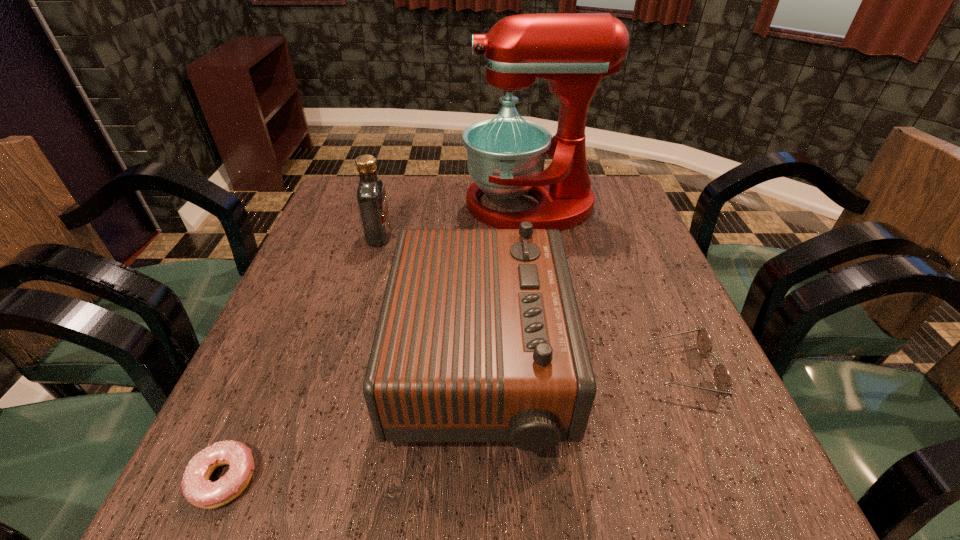
Locate an element on the screen. the tallest object is located at coordinates (572, 51).

At what (x,y) coordinates should I click in order to perform the action: click on vodka. Please return your answer as a coordinate pair (x, y). Looking at the image, I should click on (371, 194).

Find the location of a particular element. Image resolution: width=960 pixels, height=540 pixels. radio receiver is located at coordinates (479, 338).

Where is `spectacles`? This screenshot has width=960, height=540. spectacles is located at coordinates (722, 380).

Identify the location of doughnut. The height and width of the screenshot is (540, 960). (197, 488).

You are a GUI agent. You are given a task and a screenshot of the screen. Output one action in this format:
    pyautogui.click(x=<x>, y=<y>)
    Task: Click on the shortest object
    The height and width of the screenshot is (540, 960).
    Given the screenshot: What is the action you would take?
    pyautogui.click(x=197, y=488)

The image size is (960, 540). Find the location of `vacant space located 0.200m on the front-facing side of the tallest object`. vacant space located 0.200m on the front-facing side of the tallest object is located at coordinates (393, 205).

You are a GUI agent. You are given a task and a screenshot of the screen. Output one action in this format:
    pyautogui.click(x=<x>, y=<y>)
    Task: Click on the blank area located on the front-facing side of the tallest object
    The image size is (960, 540).
    Given the screenshot: What is the action you would take?
    pyautogui.click(x=346, y=205)

Locate an element on the screen. The image size is (960, 540). free spot located on the front-facing side of the tallest object is located at coordinates (343, 205).

Locate an element on the screen. This screenshot has height=540, width=960. blank area located 0.340m on the front-facing side of the vodka is located at coordinates (525, 237).